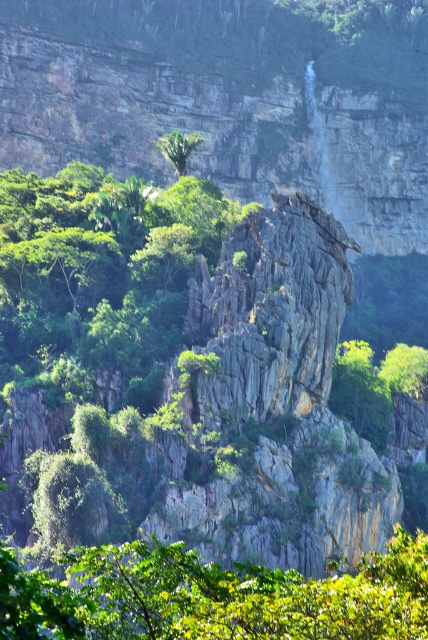
Is green leafy tree at center below green leafy tree at upper center?

Correct, green leafy tree at center is located below green leafy tree at upper center.

Describe the element at coordinates (214, 596) in the screenshot. I see `green leafy tree at center` at that location.

Identify the location of green leafy tree at center. (214, 596).